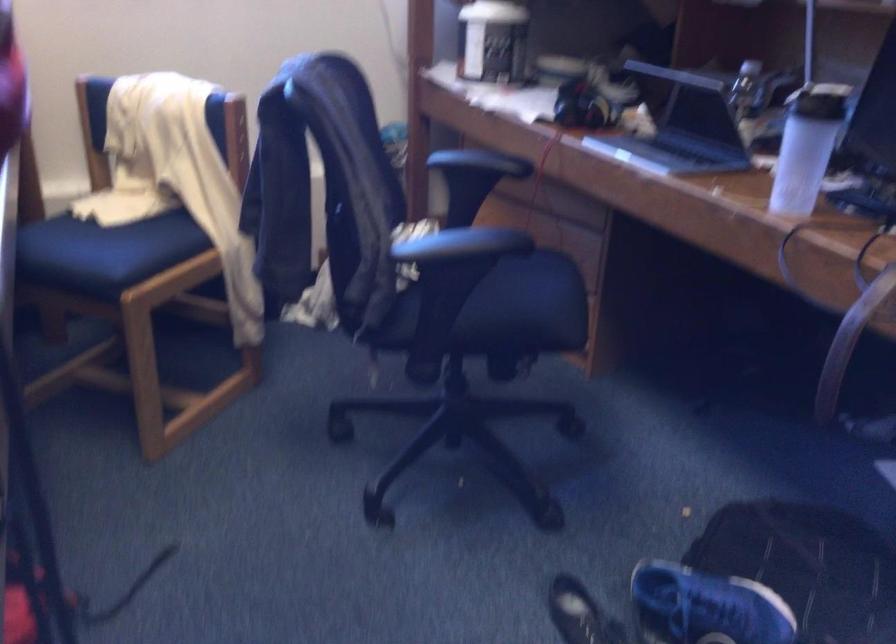
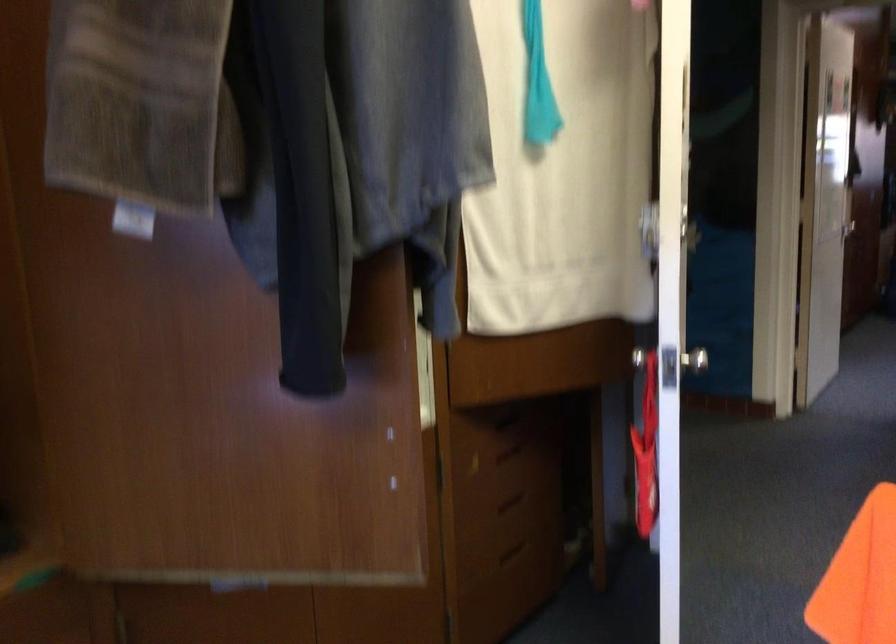
Based on the continuous images, in which direction is the camera rotating?

The camera rotated toward right-down.